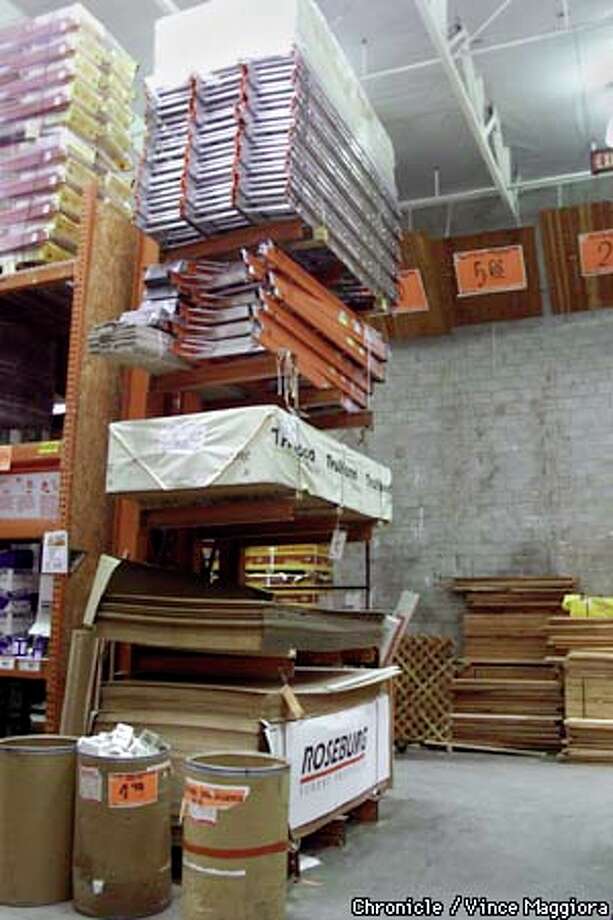
At what (x,y) coordinates should I click in order to perform the action: click on shelf. Please return your answer as a coordinate pair (x, y). Looking at the image, I should click on (21, 533).